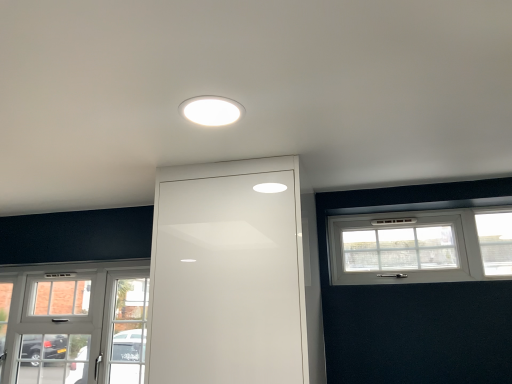
Question: Looking at their shapes, would you say white textured window at upper right, positioned as the 1th window in top-to-bottom order, is wider or thinner than white glass door at lower left, which is counted as the 1th window, starting from the back?

Choices:
 (A) wide
 (B) thin

Answer: (B)

Question: From the image's perspective, relative to white glass door at lower left, which is counted as the 1th window, starting from the back, is white textured window at upper right, marked as the 2th window in a left-to-right arrangement, above or below?

Choices:
 (A) above
 (B) below

Answer: (A)

Question: Which object is the farthest from the white glossy door at center?

Choices:
 (A) white glass door at lower left, placed as the first window when sorted from left to right
 (B) white glossy light fixture at center
 (C) white textured window at upper right, positioned as the 1th window in top-to-bottom order

Answer: (A)

Question: Considering the real-world distances, which object is closest to the white glossy light fixture at center?

Choices:
 (A) white glass door at lower left, arranged as the second window when viewed from the right
 (B) white glossy door at center
 (C) white textured window at upper right, the second window in the bottom-to-top sequence

Answer: (B)